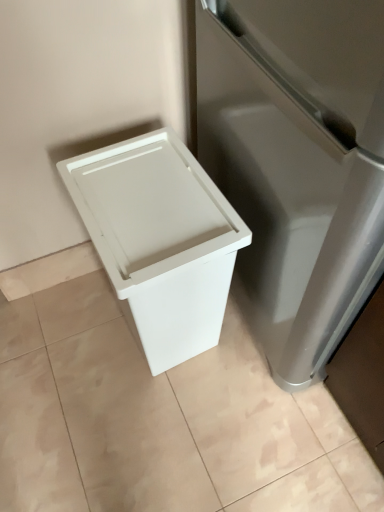
Where is `vacant space in front of white plastic waste bin at lower left`? This screenshot has height=512, width=384. vacant space in front of white plastic waste bin at lower left is located at coordinates (160, 423).